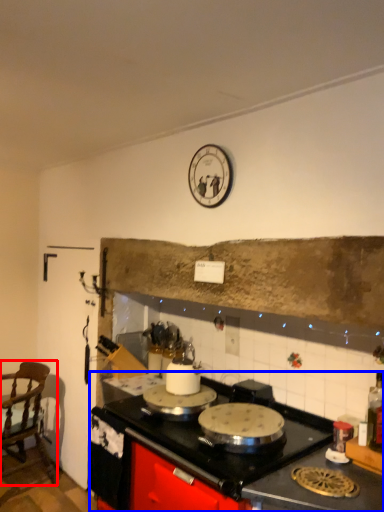
Question: Which object is closer to the camera taking this photo, chair (highlighted by a red box) or countertop (highlighted by a blue box)?

Choices:
 (A) chair
 (B) countertop

Answer: (B)